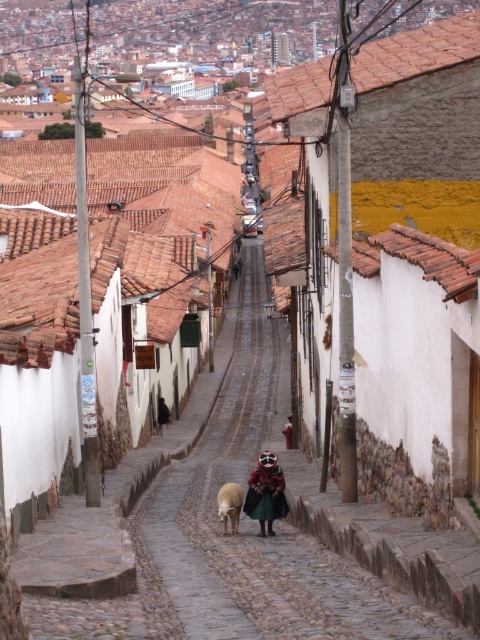
Question: Among these points, which one is farthest from the camera?

Choices:
 (A) (229, 499)
 (B) (283, 508)

Answer: (B)

Question: Which point appears closest to the camera in this image?

Choices:
 (A) (252, 502)
 (B) (224, 506)

Answer: (B)

Question: Does multicolored woven fabric at center have a lesser width compared to white woolen sheep at center?

Choices:
 (A) no
 (B) yes

Answer: (A)

Question: Which point is closer to the camera?

Choices:
 (A) multicolored woven fabric at center
 (B) white woolen sheep at center

Answer: (B)

Question: Is the position of multicolored woven fabric at center less distant than that of white woolen sheep at center?

Choices:
 (A) no
 (B) yes

Answer: (A)

Question: Does multicolored woven fabric at center appear under white woolen sheep at center?

Choices:
 (A) yes
 (B) no

Answer: (B)